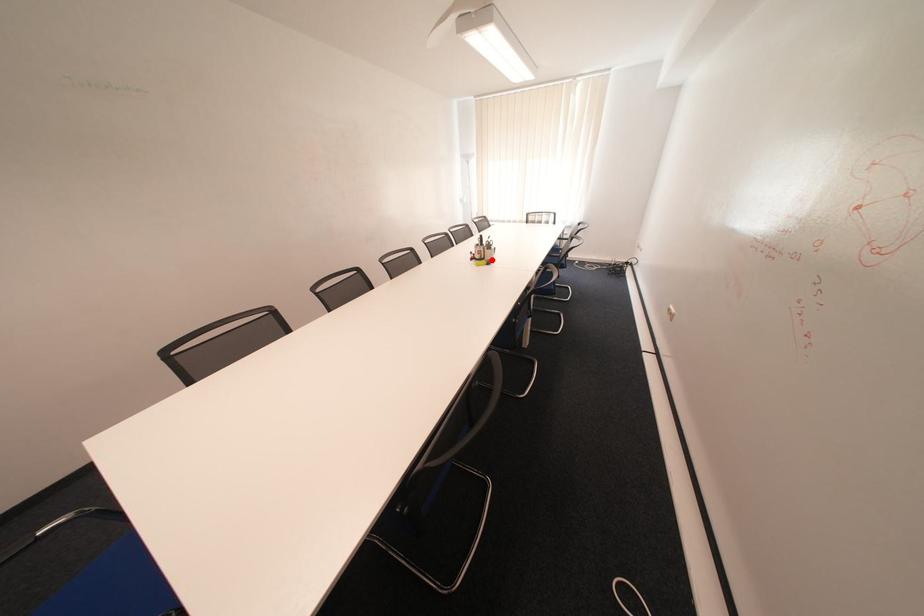
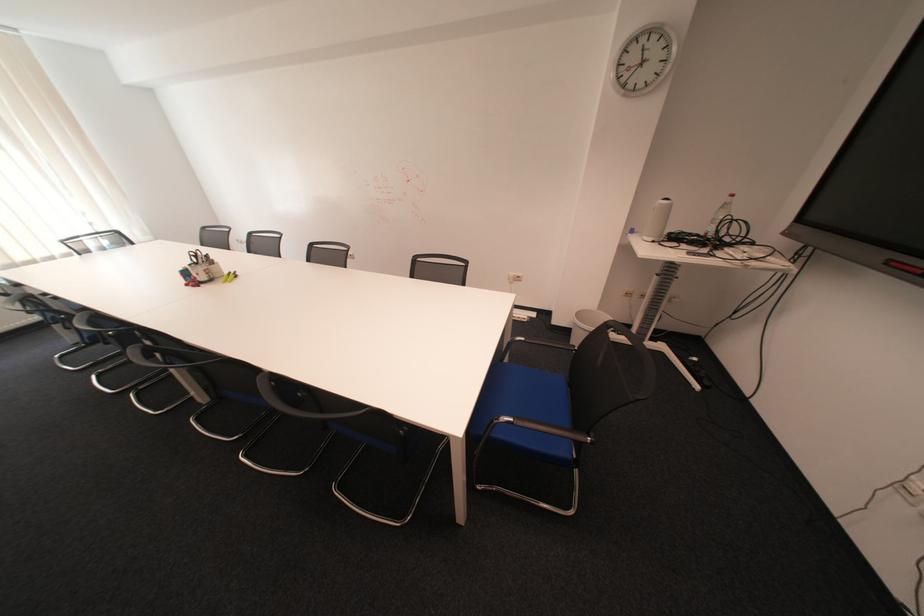
Find the pixel in the second image that matches the highlighted location in the first image.

(223, 281)